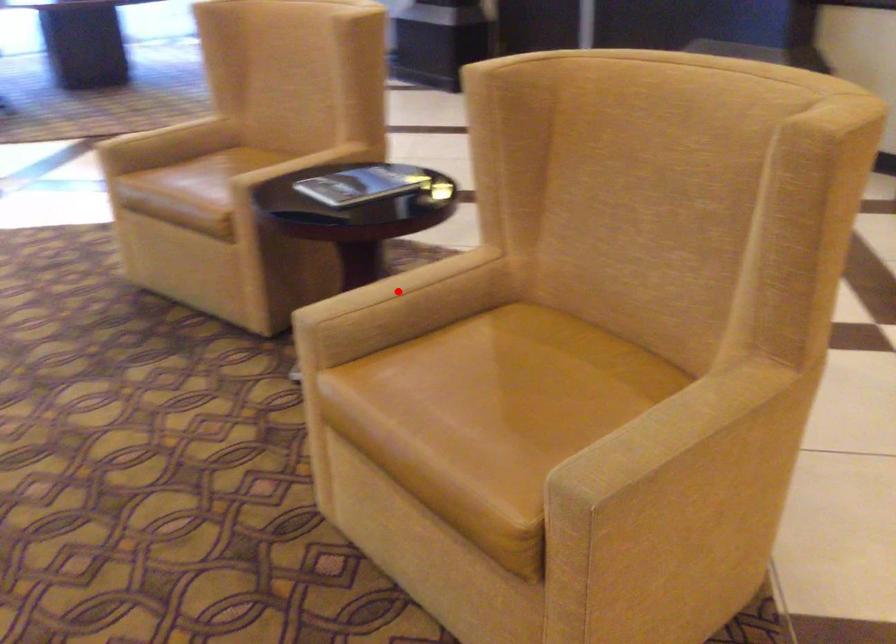
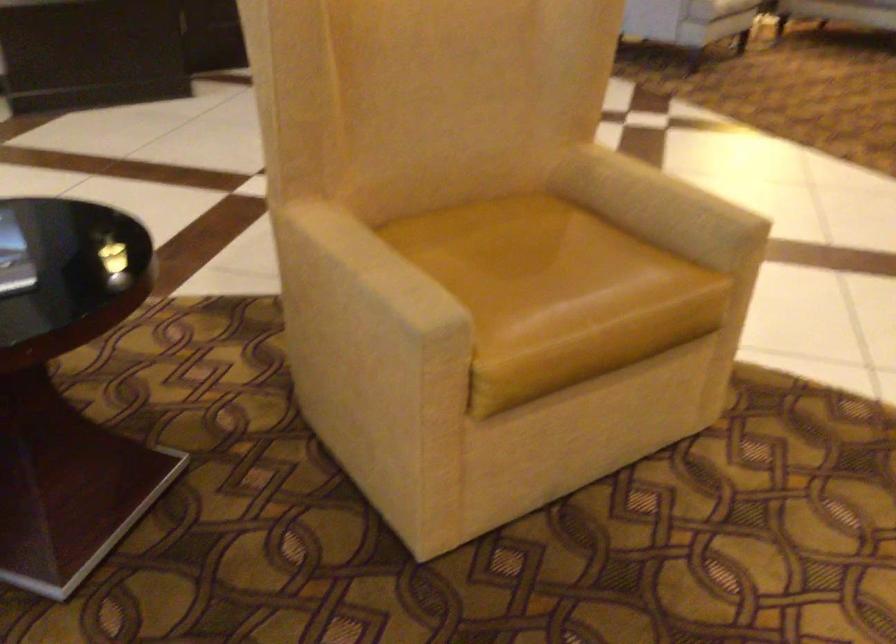
Question: I am providing you with two images of the same scene from different viewpoints. In image1, a red point is highlighted. Considering the same 3D point in image2, which of the following is correct?

Choices:
 (A) It is closer
 (B) It is farther

Answer: (A)